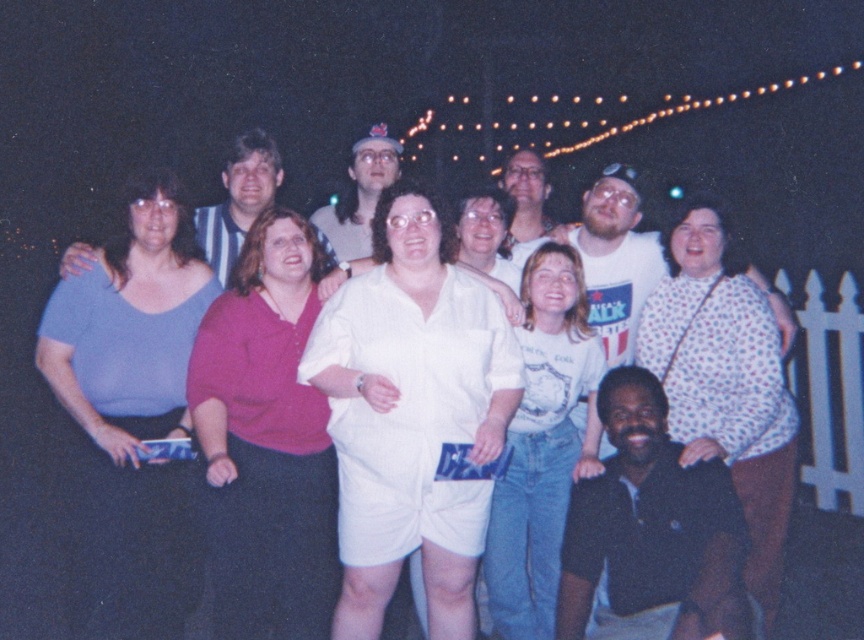
Question: Which point is closer to the camera?

Choices:
 (A) (531, 634)
 (B) (742, 456)
 (C) (473, 538)
 (D) (322, 243)

Answer: (C)

Question: Which point is closer to the camera?

Choices:
 (A) (232, 381)
 (B) (270, 168)
 (C) (530, 317)
 (D) (113, 554)

Answer: (A)

Question: Is matte blue blouse at center behind matte blue shirt at left?

Choices:
 (A) yes
 (B) no

Answer: (B)

Question: Based on their relative distances, which object is farther from the matte pink blouse at center?

Choices:
 (A) matte blue shirt at left
 (B) matte blue blouse at center
 (C) white dotted blouse at center
 (D) white cotton t-shirt at center

Answer: (C)

Question: Can you confirm if white pinstripe shorts at center is thinner than matte blue blouse at center?

Choices:
 (A) no
 (B) yes

Answer: (A)

Question: Does white pinstripe shorts at center appear over white dotted blouse at center?

Choices:
 (A) no
 (B) yes

Answer: (B)